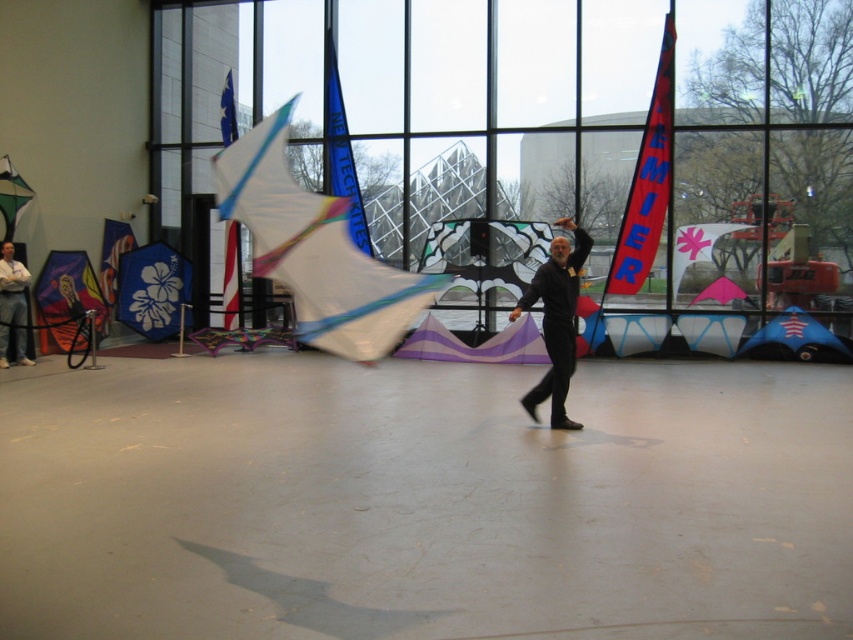
You are a photographer trying to capture the man flying the kite through the window. Which object should you focus on first, the transparent glass window at center or the black matte pants at center?

You should focus on the transparent glass window at center first because it is positioned over the black matte pants at center, making it closer to the camera and thus the primary subject in the frame.